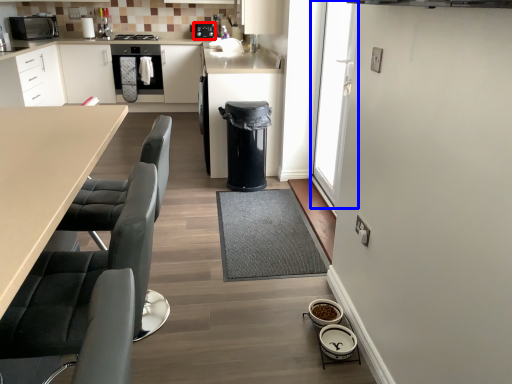
Question: Among these objects, which one is nearest to the camera, appliance (highlighted by a red box) or glass door (highlighted by a blue box)?

Choices:
 (A) appliance
 (B) glass door

Answer: (B)